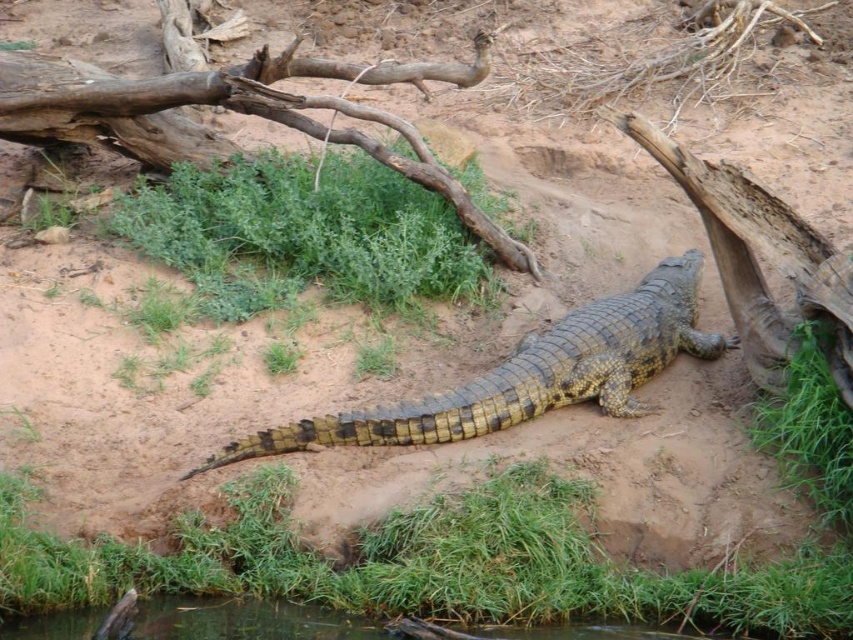
You are standing at the edge of the water in the scene and want to reach both the point at coordinates point (x=459, y=408) and point (x=210, y=609). Which point will you reach first while moving towards them?

You will reach point (x=459, y=408) first because it is closer to you than point (x=210, y=609), which is further away.